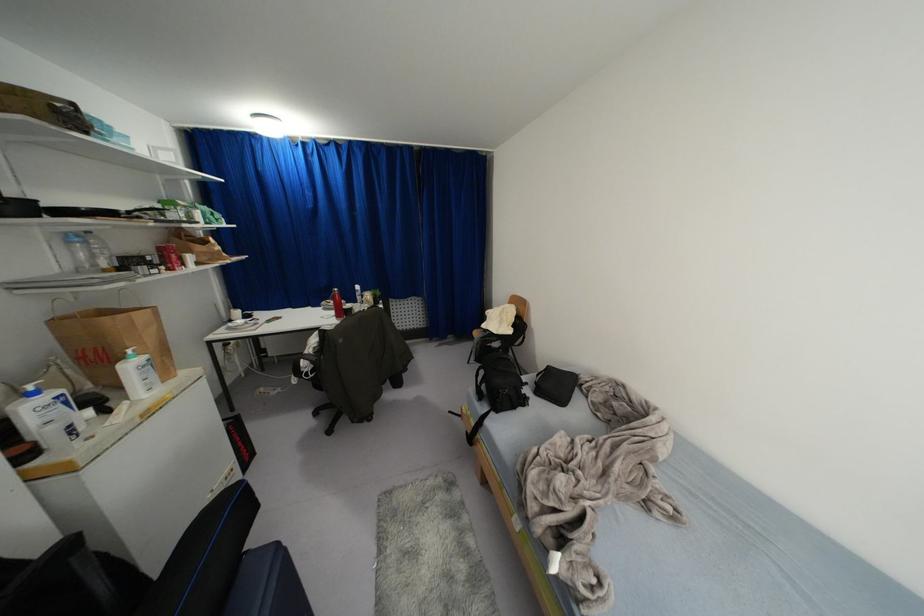
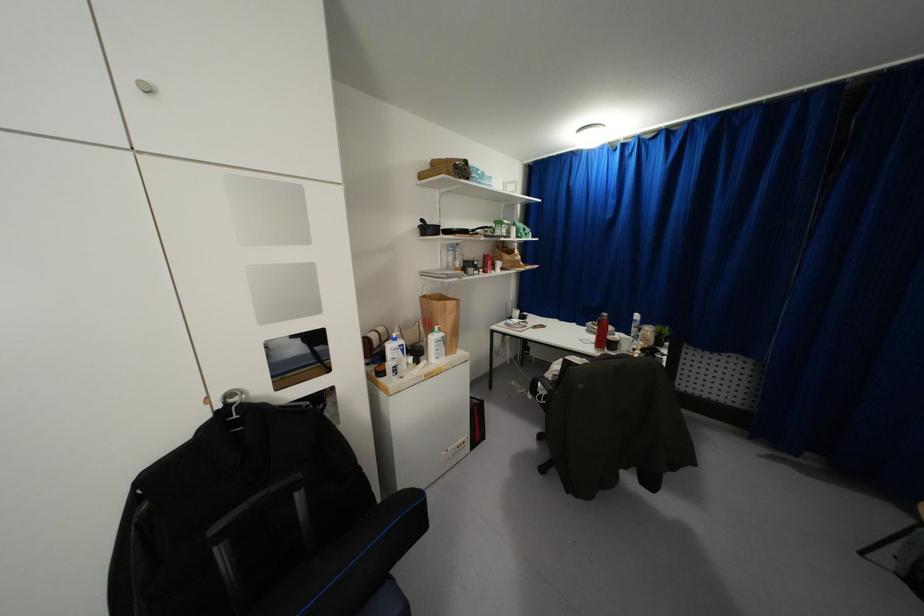
In the second image, find the point that corresponds to point (68, 241) in the first image.

(446, 249)